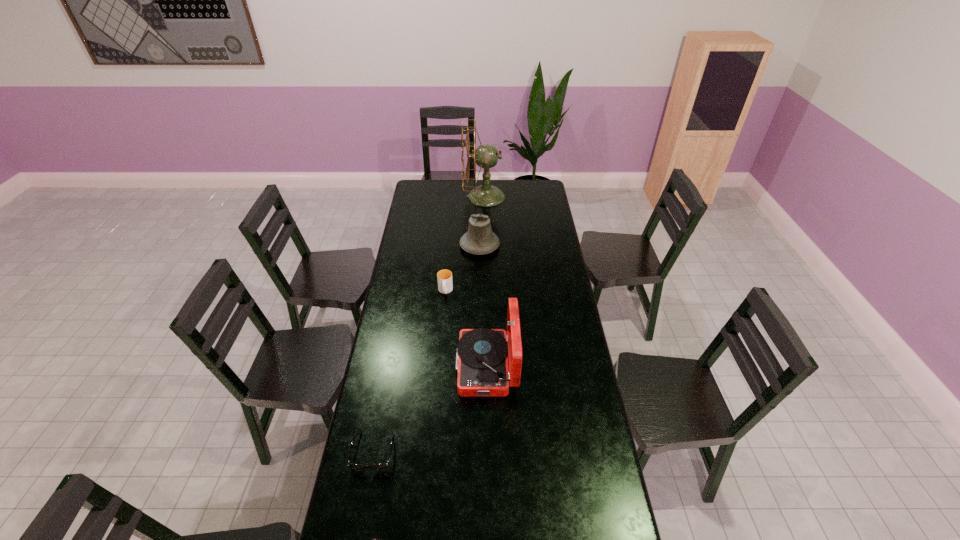
The image size is (960, 540). Find the location of `object that is at the left edge`. object that is at the left edge is located at coordinates (384, 465).

Locate an element on the screen. free space at the far edge is located at coordinates (444, 196).

Where is `free space at the left edge of the desktop`? This screenshot has width=960, height=540. free space at the left edge of the desktop is located at coordinates (427, 217).

The width and height of the screenshot is (960, 540). I want to click on vacant area at the right edge, so click(541, 223).

This screenshot has height=540, width=960. In order to click on vacant space that is in between the third shortest object and the phonograph_record in this screenshot , I will do `click(466, 329)`.

At what (x,y) coordinates should I click in order to perform the action: click on empty location between the bell and the spectacles. Please return your answer as a coordinate pair (x, y). This screenshot has height=540, width=960. Looking at the image, I should click on (426, 348).

At what (x,y) coordinates should I click in order to perform the action: click on free space between the second nearest object and the farthest object. Please return your answer as a coordinate pair (x, y). Image resolution: width=960 pixels, height=540 pixels. Looking at the image, I should click on (429, 323).

At what (x,y) coordinates should I click in order to perform the action: click on vacant space that is in between the third shortest object and the third nearest object. Please return your answer as a coordinate pair (x, y). Image resolution: width=960 pixels, height=540 pixels. Looking at the image, I should click on (466, 329).

Identify the location of vacant space in between the farthest object and the second nearest object. (429, 323).

I want to click on object that is the fifth closest to the phonograph_record, so click(x=487, y=156).